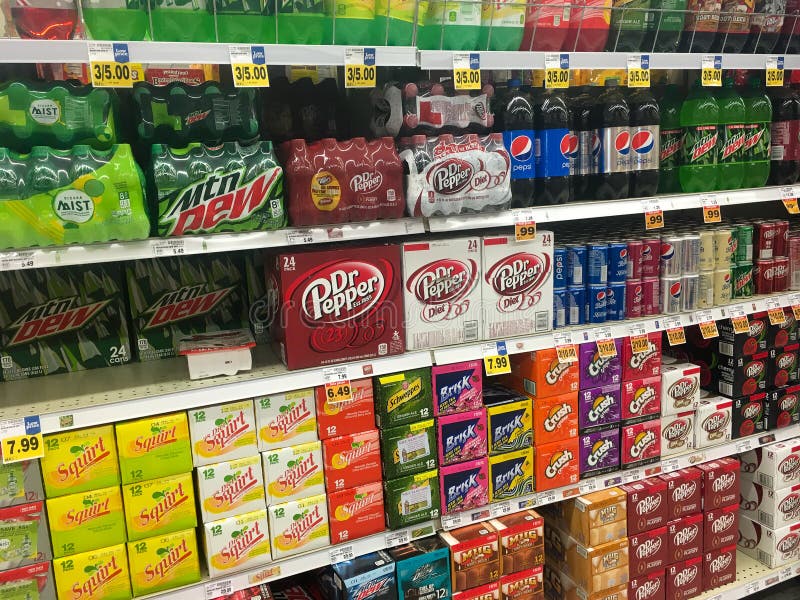
Identify the location of shelves. Image resolution: width=800 pixels, height=600 pixels. (742, 592), (724, 451), (544, 340), (612, 208), (598, 58).